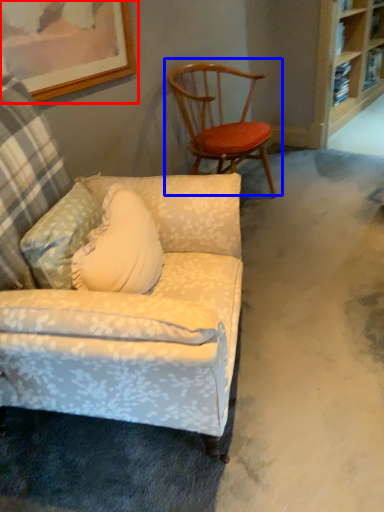
Question: Which object is further to the camera taking this photo, picture frame (highlighted by a red box) or chair (highlighted by a blue box)?

Choices:
 (A) picture frame
 (B) chair

Answer: (B)